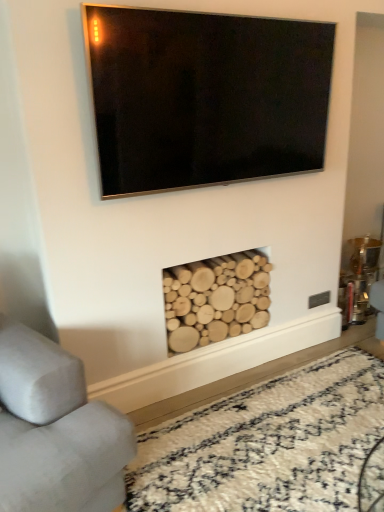
Question: Relative to natural wood logs at lower center, is matte black tv at upper center in front or behind?

Choices:
 (A) front
 (B) behind

Answer: (A)

Question: Is matte black tv at upper center to the left or to the right of natural wood logs at lower center in the image?

Choices:
 (A) left
 (B) right

Answer: (B)

Question: Based on their relative distances, which object is farther from the gray fabric couch at lower left?

Choices:
 (A) natural wood logs at lower center
 (B) natural wood logs at lower center
 (C) matte black tv at upper center

Answer: (C)

Question: Considering the real-world distances, which object is closest to the matte black tv at upper center?

Choices:
 (A) gray fabric couch at lower left
 (B) natural wood logs at lower center
 (C) natural wood logs at lower center

Answer: (C)